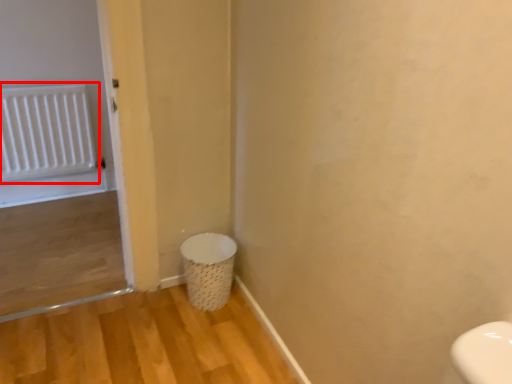
Question: From the image's perspective, what is the correct spatial positioning of radiator (annotated by the red box) in reference to laundry basket?

Choices:
 (A) above
 (B) below

Answer: (A)